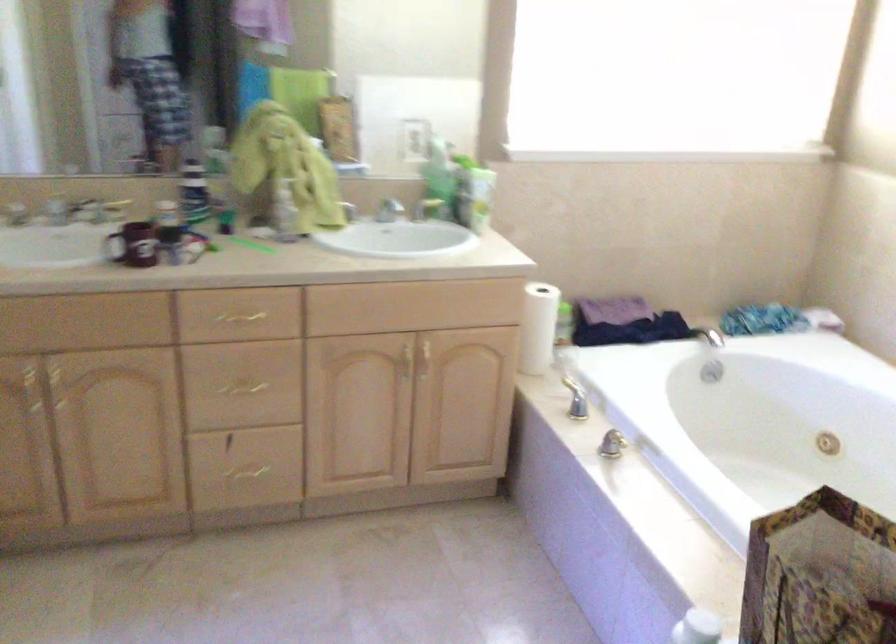
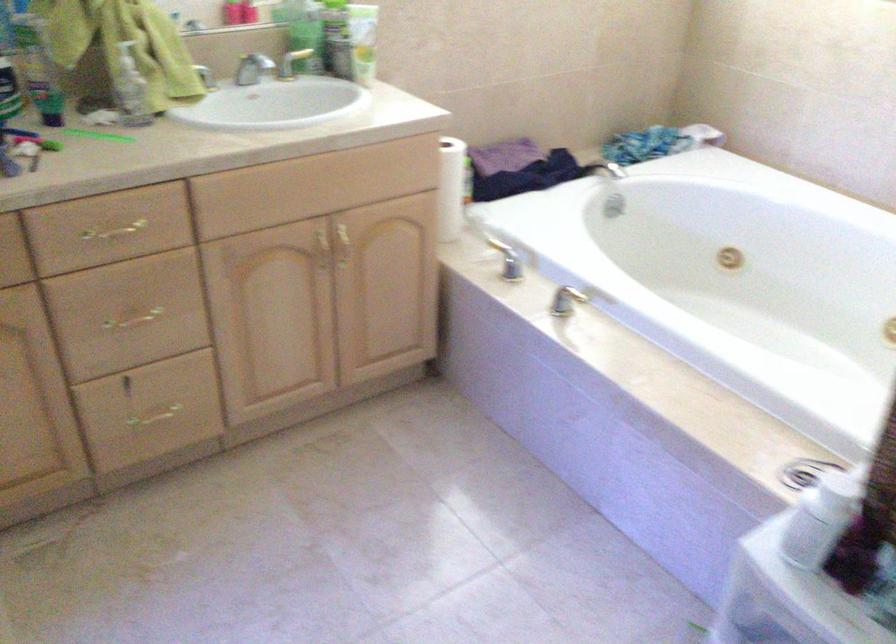
Locate, in the second image, the point that corresponds to point 237,315 in the first image.

(114, 230)